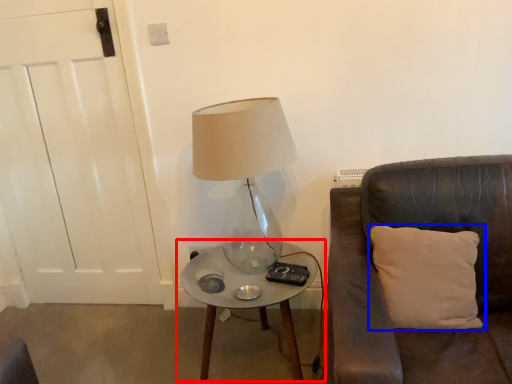
Question: Among these objects, which one is farthest to the camera, table (highlighted by a red box) or pillow (highlighted by a blue box)?

Choices:
 (A) table
 (B) pillow

Answer: (A)